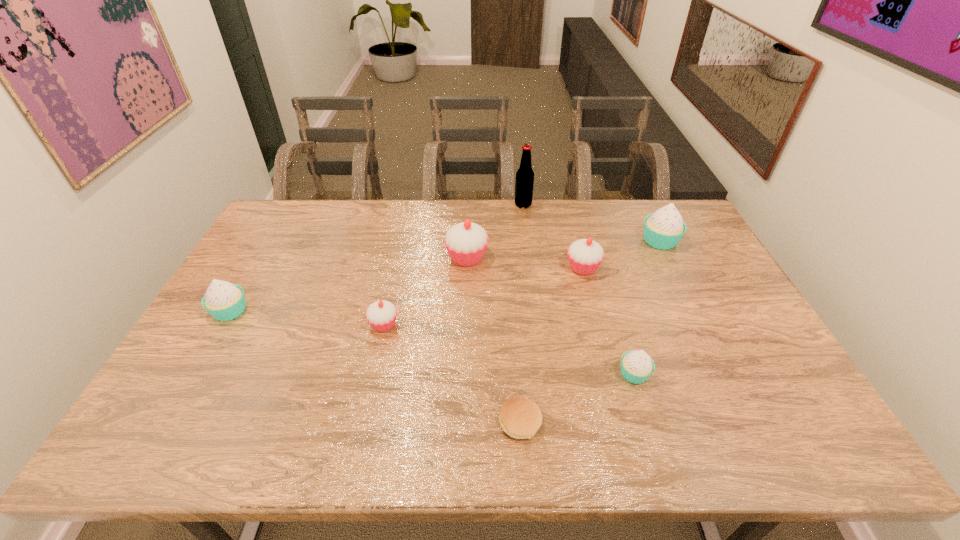
Locate an element on the screen. The height and width of the screenshot is (540, 960). vacant space at the near edge of the desktop is located at coordinates (593, 451).

Find the location of a particular element. free space at the left edge of the desktop is located at coordinates (221, 386).

The width and height of the screenshot is (960, 540). What are the coordinates of `vacant point at the right edge` in the screenshot? It's located at (770, 399).

This screenshot has height=540, width=960. In the image, there is a desktop. In order to click on free space at the far left corner in this screenshot , I will do `click(304, 202)`.

The width and height of the screenshot is (960, 540). In order to click on free space at the near right corner in this screenshot , I will do `click(798, 446)`.

Find the location of `vacant area that lies between the second farthest white cupcake and the third object from left to right`. vacant area that lies between the second farthest white cupcake and the third object from left to right is located at coordinates 348,285.

Identify the location of unoccupied position between the second nearest white cupcake and the third object from left to right. (348, 285).

You are a GUI agent. You are given a task and a screenshot of the screen. Output one action in this format:
    pyautogui.click(x=<x>, y=<y>)
    Task: Click on the vacant area between the rightmost object and the second nearest object
    This screenshot has width=960, height=540.
    Given the screenshot: What is the action you would take?
    pyautogui.click(x=647, y=307)

Locate an element on the screen. vacant area between the biggest pink cupcake and the farthest object is located at coordinates (495, 232).

Find the location of a particular element. This screenshot has height=540, width=960. vacant area that lies between the shortest object and the leftmost white cupcake is located at coordinates (375, 367).